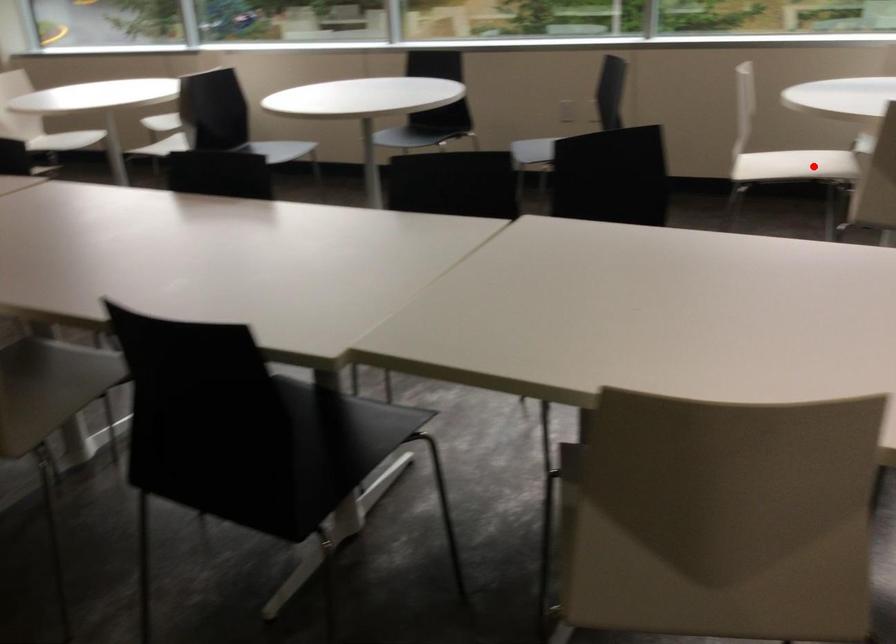
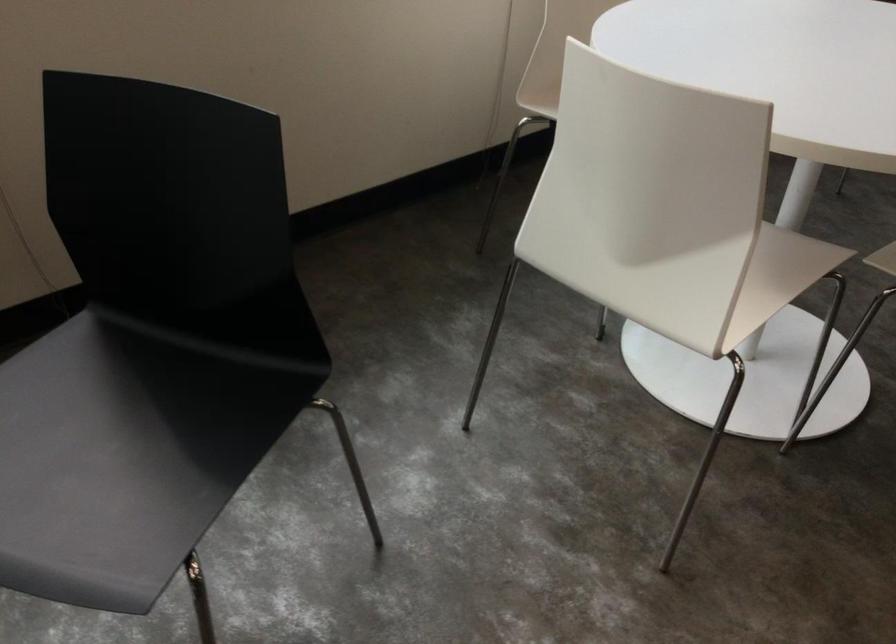
Question: I am providing you with two images of the same scene from different viewpoints. Image1 has a red point marked. In image2, the corresponding 3D location appears at what relative position? Reply with the corresponding letter.

Choices:
 (A) Closer
 (B) Farther

Answer: (A)